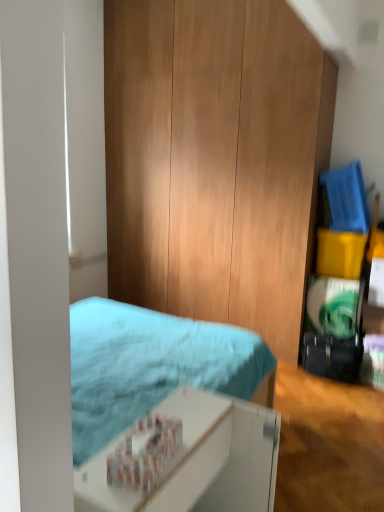
Question: Is yellow matte box at right smaller than white cardboard box at lower center?

Choices:
 (A) no
 (B) yes

Answer: (B)

Question: Does yellow matte box at right have a larger size compared to white cardboard box at lower center?

Choices:
 (A) no
 (B) yes

Answer: (A)

Question: Is yellow matte box at right aimed at white cardboard box at lower center?

Choices:
 (A) no
 (B) yes

Answer: (B)

Question: Is yellow matte box at right not inside white cardboard box at lower center?

Choices:
 (A) yes
 (B) no

Answer: (A)

Question: Considering the relative sizes of yellow matte box at right and white cardboard box at lower center in the image provided, is yellow matte box at right taller than white cardboard box at lower center?

Choices:
 (A) yes
 (B) no

Answer: (B)

Question: Considering the relative positions of yellow matte box at right and white cardboard box at lower center in the image provided, is yellow matte box at right to the left of white cardboard box at lower center from the viewer's perspective?

Choices:
 (A) yes
 (B) no

Answer: (B)

Question: Considering the relative sizes of white cardboard box at lower center and yellow matte box at right in the image provided, is white cardboard box at lower center wider than yellow matte box at right?

Choices:
 (A) yes
 (B) no

Answer: (B)

Question: Considering the relative positions of white cardboard box at lower center and yellow matte box at right in the image provided, is white cardboard box at lower center in front of yellow matte box at right?

Choices:
 (A) no
 (B) yes

Answer: (B)

Question: Is the surface of white cardboard box at lower center in direct contact with yellow matte box at right?

Choices:
 (A) no
 (B) yes

Answer: (A)

Question: Considering the relative positions of white cardboard box at lower center and yellow matte box at right in the image provided, is white cardboard box at lower center to the left of yellow matte box at right from the viewer's perspective?

Choices:
 (A) no
 (B) yes

Answer: (B)

Question: Does white cardboard box at lower center have a larger size compared to yellow matte box at right?

Choices:
 (A) no
 (B) yes

Answer: (B)

Question: Does white cardboard box at lower center have a smaller size compared to yellow matte box at right?

Choices:
 (A) yes
 (B) no

Answer: (B)

Question: Considering the positions of white cardboard box at lower center and yellow matte box at right in the image, is white cardboard box at lower center bigger or smaller than yellow matte box at right?

Choices:
 (A) small
 (B) big

Answer: (B)